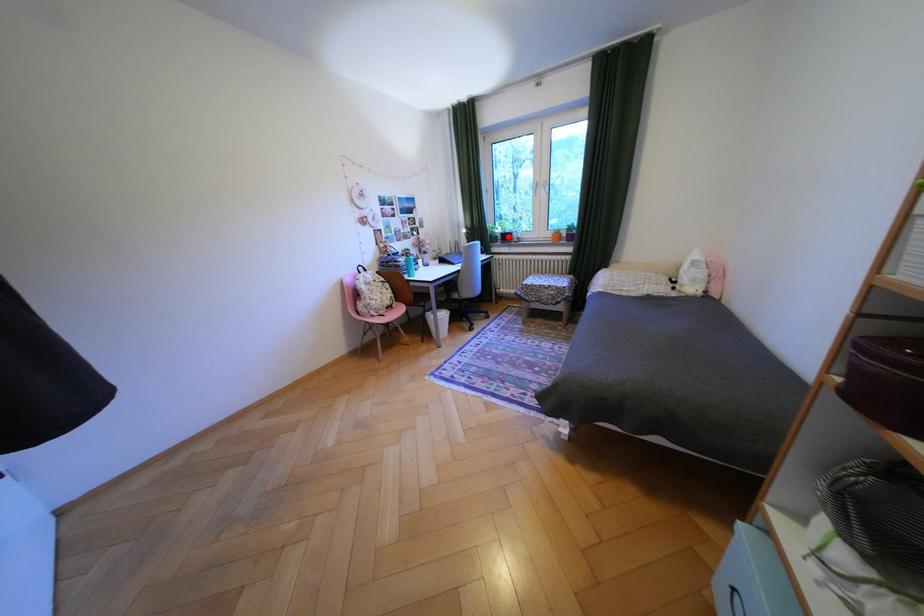
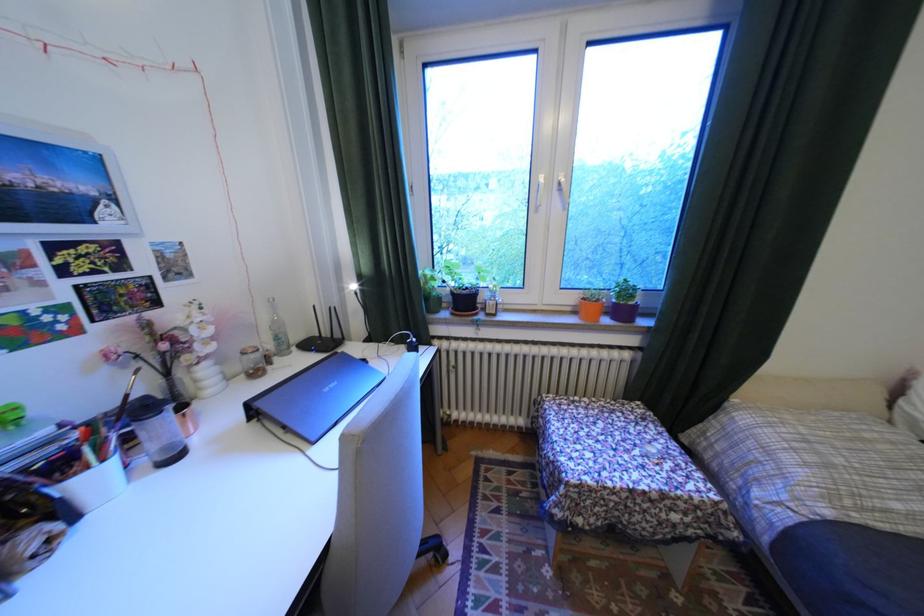
In the second image, find the point that corresponds to the highlighted location in the first image.

(451, 299)